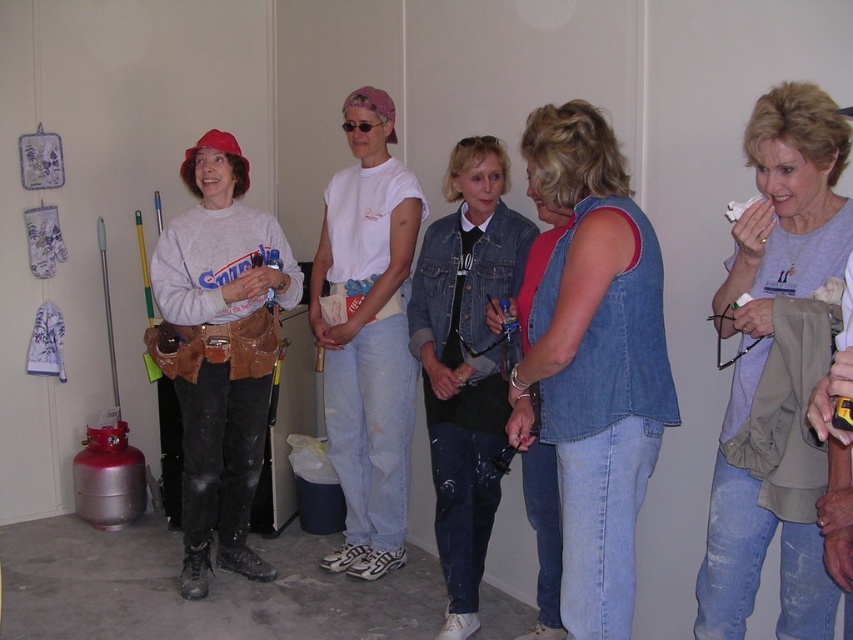
Who is taller, matte gray sweatshirt at left or denim jacket at center?

matte gray sweatshirt at left

Image resolution: width=853 pixels, height=640 pixels. Find the location of `matte gray sweatshirt at left`. matte gray sweatshirt at left is located at coordinates (219, 349).

Can you confirm if denim vest at center is bigger than gray matte shirt at upper right?

Correct, denim vest at center is larger in size than gray matte shirt at upper right.

Does denim vest at center have a lesser width compared to gray matte shirt at upper right?

No, denim vest at center is not thinner than gray matte shirt at upper right.

Between point (624, 609) and point (720, 320), which one is positioned behind?

The point (624, 609) is more distant.

Locate an element on the screen. denim vest at center is located at coordinates tap(593, 360).

Consider the image. Which is more to the right, matte gray sweatshirt at left or gray matte shirt at upper right?

From the viewer's perspective, gray matte shirt at upper right appears more on the right side.

Is matte gray sweatshirt at left further to the viewer compared to gray matte shirt at upper right?

Yes, it is.

Measure the distance between point (264, 262) and camera.

Point (264, 262) and camera are 3.01 meters apart from each other.

Image resolution: width=853 pixels, height=640 pixels. Identify the location of matte gray sweatshirt at left. (219, 349).